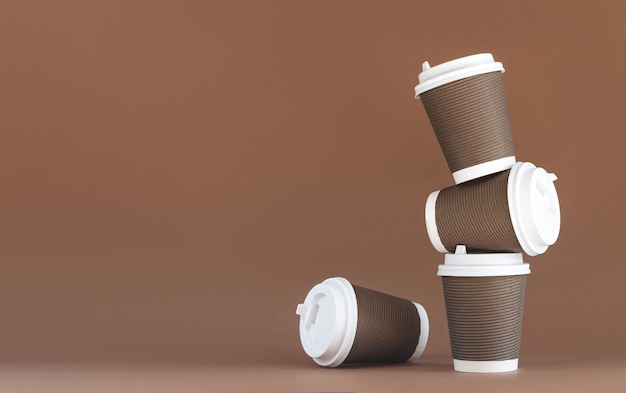
Identify the location of disposal coffee cups with caps in a rendering. (369, 326), (493, 317), (490, 211), (491, 115).